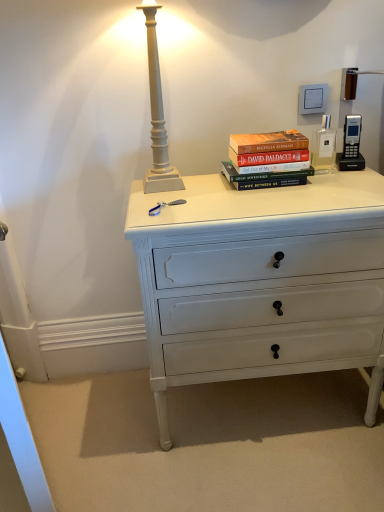
Question: In which direction should I rotate to look at white painted wood chest of drawers at center?

Choices:
 (A) left
 (B) right

Answer: (B)

Question: Can you confirm if hardcover books at center is wider than white painted wood chest of drawers at center?

Choices:
 (A) yes
 (B) no

Answer: (B)

Question: Is white painted wood chest of drawers at center surrounded by hardcover books at center?

Choices:
 (A) no
 (B) yes

Answer: (A)

Question: Is hardcover books at center further to camera compared to white painted wood chest of drawers at center?

Choices:
 (A) no
 (B) yes

Answer: (B)

Question: From the image's perspective, does hardcover books at center appear lower than white painted wood chest of drawers at center?

Choices:
 (A) no
 (B) yes

Answer: (A)

Question: Does hardcover books at center have a smaller size compared to white painted wood chest of drawers at center?

Choices:
 (A) yes
 (B) no

Answer: (A)

Question: Would you say hardcover books at center is a long distance from white painted wood chest of drawers at center?

Choices:
 (A) no
 (B) yes

Answer: (A)

Question: From a real-world perspective, is white painted wood chest of drawers at center under hardcover books at center?

Choices:
 (A) no
 (B) yes

Answer: (B)

Question: Is white painted wood chest of drawers at center aimed at hardcover books at center?

Choices:
 (A) no
 (B) yes

Answer: (A)

Question: Is white painted wood chest of drawers at center touching hardcover books at center?

Choices:
 (A) no
 (B) yes

Answer: (A)

Question: Is white painted wood chest of drawers at center wider than hardcover books at center?

Choices:
 (A) yes
 (B) no

Answer: (A)

Question: Is white painted wood chest of drawers at center looking in the opposite direction of hardcover books at center?

Choices:
 (A) yes
 (B) no

Answer: (B)

Question: Considering the relative positions of white painted wood chest of drawers at center and hardcover books at center in the image provided, is white painted wood chest of drawers at center behind hardcover books at center?

Choices:
 (A) no
 (B) yes

Answer: (A)

Question: Is white painted wood chest of drawers at center in front of or behind hardcover books at center in the image?

Choices:
 (A) behind
 (B) front

Answer: (B)